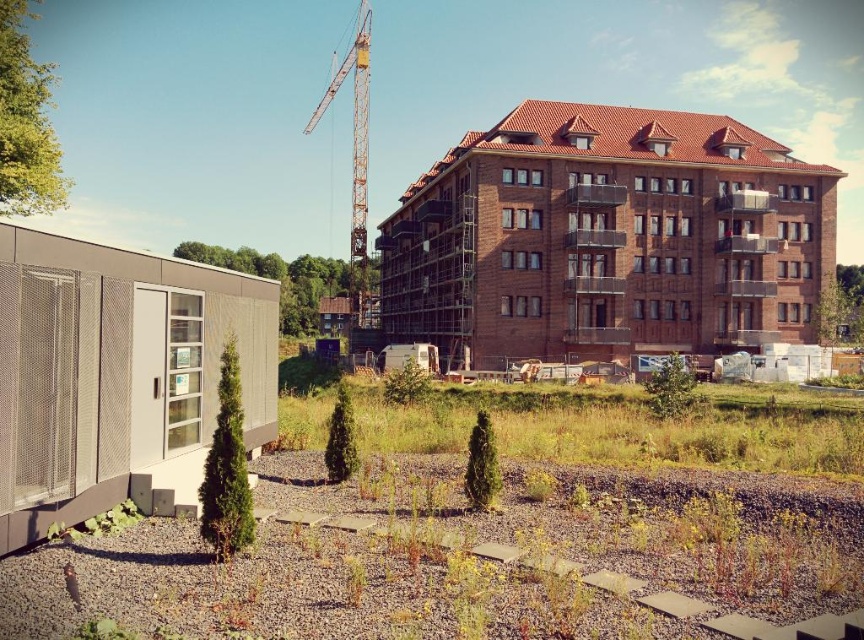
You are a construction worker who needs to transport materials from the temporary offices to the main building. Given that the brown brick building at center is smaller than the yellow painted metal crane at upper center, which direction should you head towards the main building from the temporary offices?

The brown brick building at center is smaller than the yellow painted metal crane at upper center. Since the crane is at upper center, you should head towards the direction where the brown brick building at center is located, which is the main building, from the temporary offices on the left.

You are a construction inspector who needs to ensure safety distances between the brown brick building at center and the yellow painted metal crane at upper center. According to regulations, the crane must be at least 10 meters away from the building. Can you determine if the crane is positioned safely based on their sizes?

The brown brick building at center is wider than the yellow painted metal crane at upper center. However, the size comparison alone does not provide information about the distance between them. Additional measurements or spatial data would be needed to confirm compliance with safety regulations.

You are a delivery truck driver who needs to park your truck which is 10 meters long. You see the brown brick building at center and the yellow painted metal crane at upper center. Is there enough space between them to park your truck?

The brown brick building at center is 33.99 meters from the yellow painted metal crane at upper center. Since the truck is 10 meters long, there is sufficient space between them to park the truck.